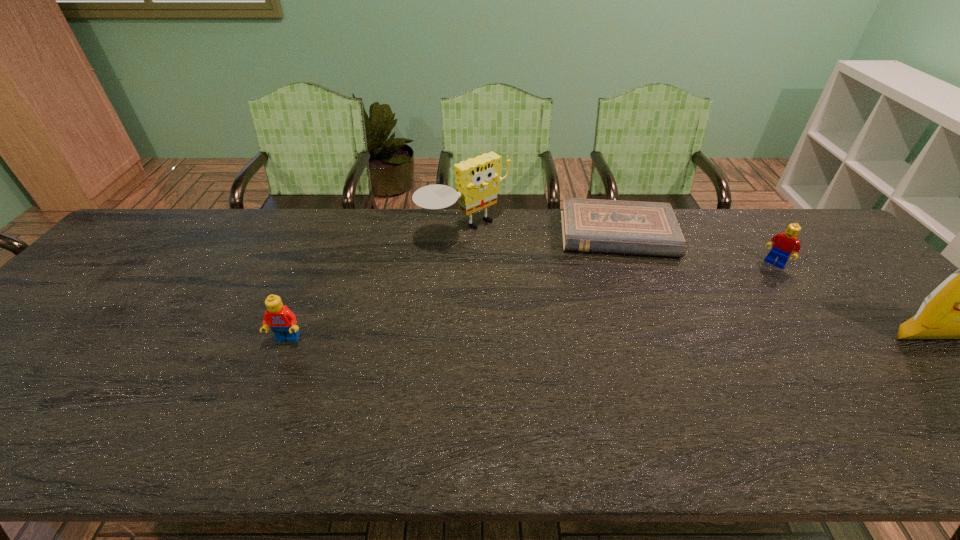
The height and width of the screenshot is (540, 960). I want to click on vacant spot on the desktop that is between the left Lego and the crisp (potato chip) and is positioned on the front-facing side of the farther Lego, so click(x=705, y=339).

This screenshot has height=540, width=960. What are the coordinates of `vacant spot on the desktop that is between the leftmost object and the tallest object and is positioned on the front-facing side of the sponge` in the screenshot? It's located at (598, 339).

This screenshot has height=540, width=960. I want to click on vacant spot on the desktop that is between the leftmost object and the crisp (potato chip) and is positioned on the spine side of the third object from left to right, so click(x=640, y=339).